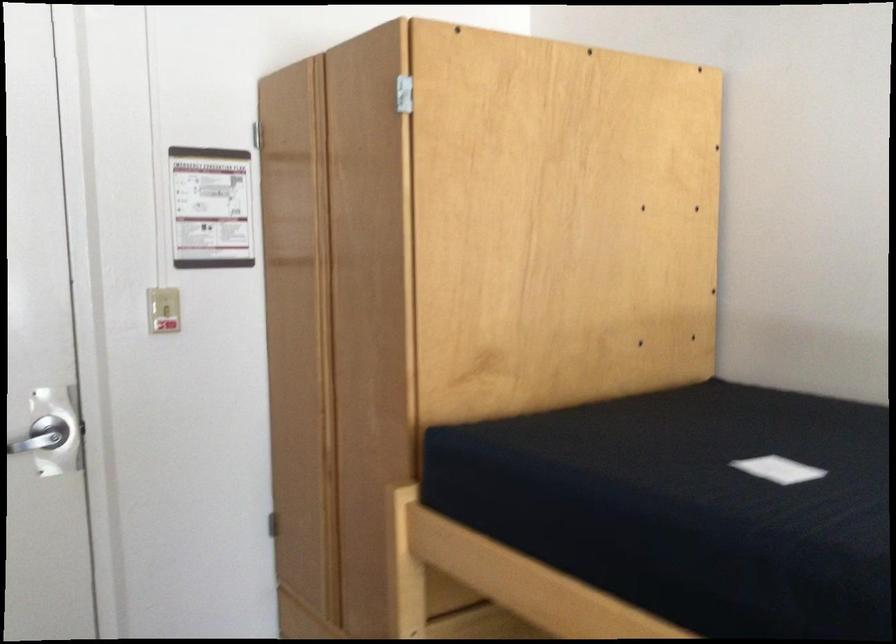
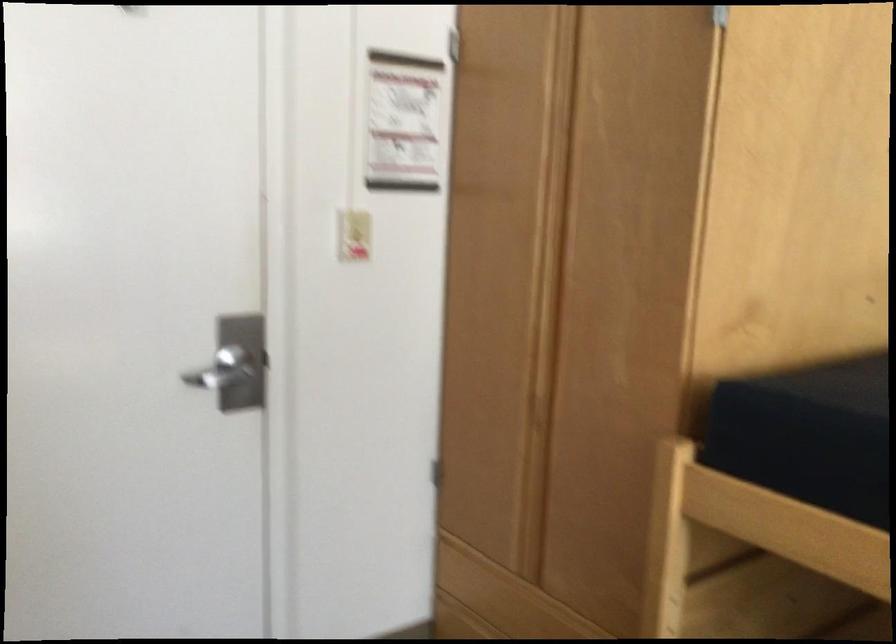
Question: How did the camera likely rotate?

Choices:
 (A) Left
 (B) Right
 (C) Up
 (D) Down

Answer: (D)